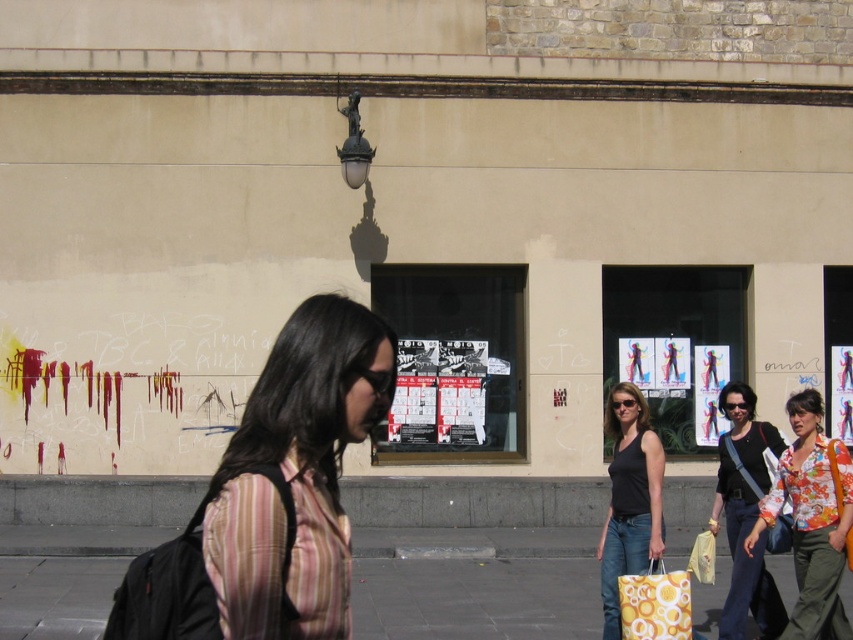
Question: Is black matte tank top at center positioned behind colorful paper poster at center?

Choices:
 (A) no
 (B) yes

Answer: (A)

Question: Can you confirm if floral print shirt at center is positioned above yellow printed fabric shopping bag at lower right?

Choices:
 (A) no
 (B) yes

Answer: (B)

Question: Considering the real-world distances, which object is farthest from the colorful paper poster at center?

Choices:
 (A) smooth concrete pavement at lower center
 (B) black matte tank top at center
 (C) pink striped shirt at center
 (D) floral print shirt at center

Answer: (C)

Question: Can you confirm if smooth concrete pavement at lower center is smaller than floral print shirt at center?

Choices:
 (A) yes
 (B) no

Answer: (A)

Question: Which point appears farthest from the camera in this image?

Choices:
 (A) (672, 573)
 (B) (4, 628)
 (C) (471, 432)
 (D) (699, 355)

Answer: (D)

Question: Estimate the real-world distances between objects in this image. Which object is farther from the smooth concrete pavement at lower center?

Choices:
 (A) floral print shirt at center
 (B) matte black tank top at center right
 (C) yellow printed fabric shopping bag at lower right
 (D) black matte tank top at center

Answer: (C)